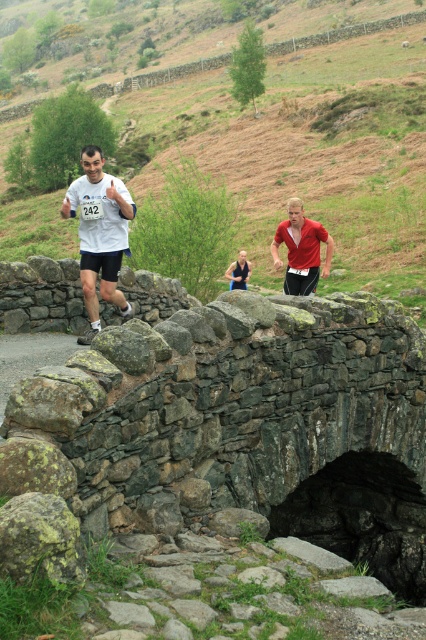
Question: Estimate the real-world distances between objects in this image. Which object is farther from the red fabric shirt at center?

Choices:
 (A) white matte shirt at center
 (B) green grassy hillside at upper center

Answer: (B)

Question: Can you confirm if white matte shirt at center is bigger than red matte shirt at center?

Choices:
 (A) yes
 (B) no

Answer: (B)

Question: From the image, what is the correct spatial relationship of green grassy hillside at upper center in relation to white matte shirt at center?

Choices:
 (A) above
 (B) below

Answer: (A)

Question: Which of these objects is positioned closest to the green grassy hillside at upper center?

Choices:
 (A) red matte shirt at center
 (B) red fabric shirt at center

Answer: (A)

Question: Observing the image, what is the correct spatial positioning of white matte shirt at center in reference to red matte shirt at center?

Choices:
 (A) left
 (B) right

Answer: (A)

Question: Which of the following is the closest to the observer?

Choices:
 (A) red matte shirt at center
 (B) green grassy hillside at upper center

Answer: (A)